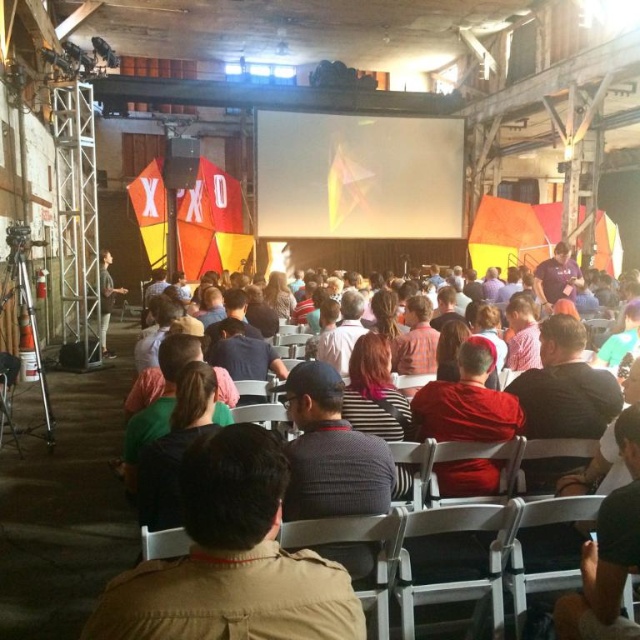
Who is lower down, red matte shirt at center or dark gray shirt at left?

Positioned lower is red matte shirt at center.

Is red matte shirt at center positioned behind dark gray shirt at left?

No.

Does point (474, 342) lie in front of point (99, 298)?

Yes, it is.

Image resolution: width=640 pixels, height=640 pixels. I want to click on red matte shirt at center, so click(x=467, y=401).

Is brown fabric jacket at center positioned behind white glossy screen at center?

No.

Does brown fabric jacket at center have a larger size compared to white glossy screen at center?

Incorrect, brown fabric jacket at center is not larger than white glossy screen at center.

Who is more forward, (332, 580) or (273, 200)?

Positioned in front is point (332, 580).

You are a GUI agent. You are given a task and a screenshot of the screen. Output one action in this format:
    pyautogui.click(x=<x>, y=<y>)
    Task: Click on the brown fabric jacket at center
    The image size is (640, 640).
    Given the screenshot: What is the action you would take?
    pyautogui.click(x=230, y=560)

Between point (560, 264) and point (100, 288), which one is positioned in front?

Point (100, 288) is more forward.

Is purple cotton shirt at center behind dark gray shirt at left?

No, purple cotton shirt at center is closer to the viewer.

Who is more distant from viewer, (538, 275) or (112, 260)?

The point (112, 260) is more distant.

At what (x,y) coordinates should I click in order to perform the action: click on purple cotton shirt at center. Please return your answer as a coordinate pair (x, y). The width and height of the screenshot is (640, 640). Looking at the image, I should click on (556, 276).